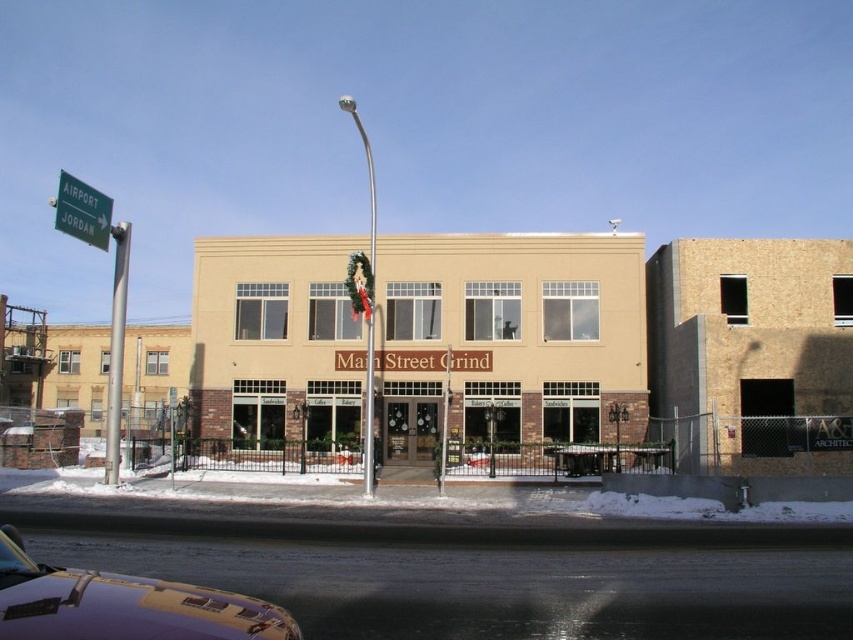
You are standing in front of the building and want to take a photo of the snow without including the street sign. Is the white powdery snow at lower center within your camera frame if you are 14 meters away from it?

The white powdery snow at lower center is 14.26 meters away from the camera. Since you are 14 meters away from it, you can move slightly closer to ensure the snow is within the frame while excluding the street sign.